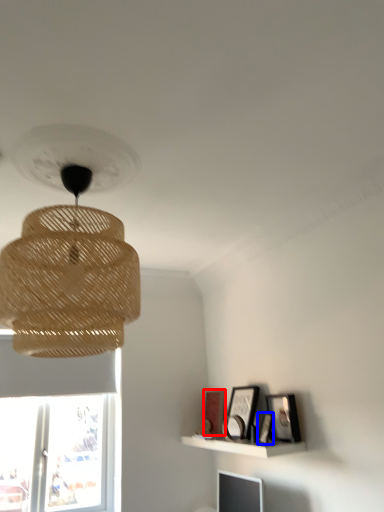
Question: Which of the following is the farthest to the observer, picture frame (highlighted by a red box) or picture frame (highlighted by a blue box)?

Choices:
 (A) picture frame
 (B) picture frame

Answer: (A)